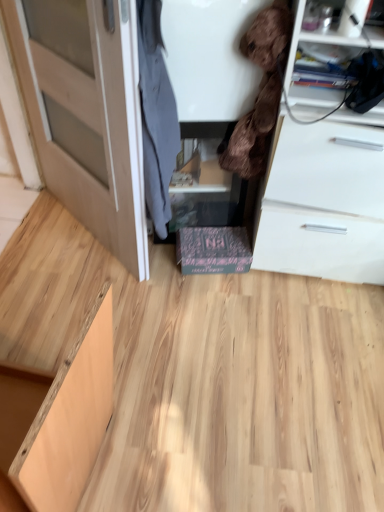
This screenshot has height=512, width=384. Identify the location of vacant space that's between light wood cabinet at lower left, acting as the first cabinetry starting from the front, and black cardboard box at center, the first cabinetry from the back. (168, 338).